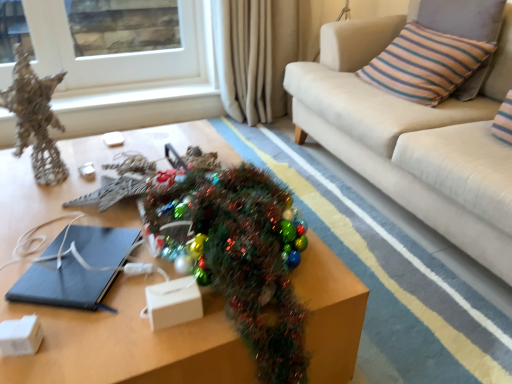
Where is `vacant space situated on the left part of matte black notebook at center`? The height and width of the screenshot is (384, 512). vacant space situated on the left part of matte black notebook at center is located at coordinates (20, 249).